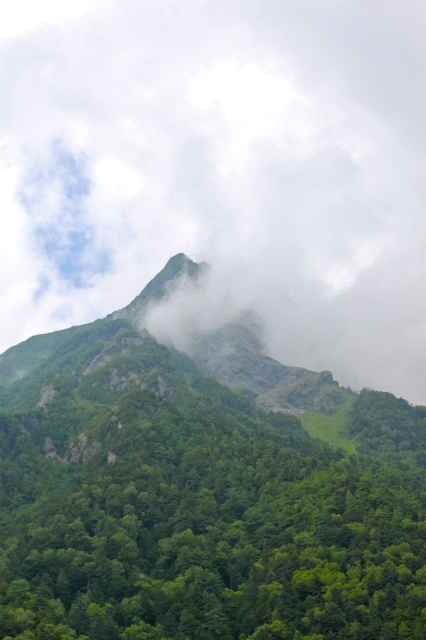
You are a hiker planning to travel from point A to point B. Point A is at coordinate point (417, 58) and point B is at coordinate point (176, 534). Given that the path between them is 1.2 kilometers long, and you can walk at 3 km per hour, how long will it take you to reach point B from point A?

The path between point (417, 58) and point (176, 534) is 1.2 kilometers long. At a walking speed of 3 km per hour, it would take 24 minutes to reach point B from point A.